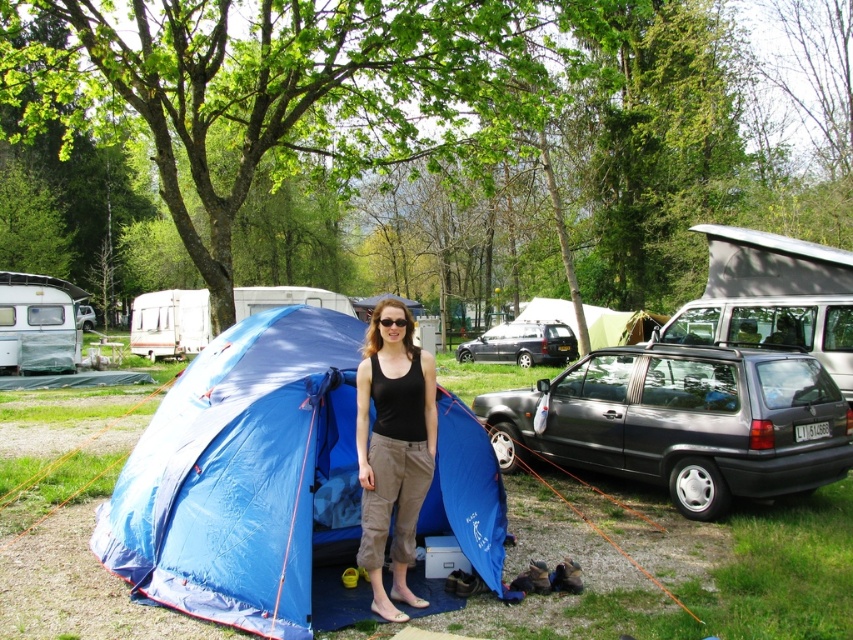
Between black fabric tank top at center and metallic gray hatchback at center, which one is positioned higher?

metallic gray hatchback at center

Based on the photo, is black fabric tank top at center to the right of metallic gray hatchback at center from the viewer's perspective?

Incorrect, black fabric tank top at center is not on the right side of metallic gray hatchback at center.

Which is in front, point (367, 436) or point (523, 360)?

Point (367, 436) is more forward.

Locate an element on the screen. black fabric tank top at center is located at coordinates (393, 449).

Locate an element on the screen. The image size is (853, 640). matte gray hatchback at right is located at coordinates (682, 420).

Describe the element at coordinates (682, 420) in the screenshot. I see `matte gray hatchback at right` at that location.

Which is in front, point (778, 445) or point (553, 348)?

Point (778, 445) is in front.

Locate an element on the screen. matte gray hatchback at right is located at coordinates (682, 420).

Is blue fabric tent at center behind black fabric tank top at center?

No, blue fabric tent at center is in front of black fabric tank top at center.

What do you see at coordinates (242, 476) in the screenshot? I see `blue fabric tent at center` at bounding box center [242, 476].

Who is more distant from viewer, (x=335, y=320) or (x=413, y=477)?

Positioned behind is point (x=335, y=320).

At what (x,y) coordinates should I click in order to perform the action: click on blue fabric tent at center. Please return your answer as a coordinate pair (x, y). The height and width of the screenshot is (640, 853). Looking at the image, I should click on (242, 476).